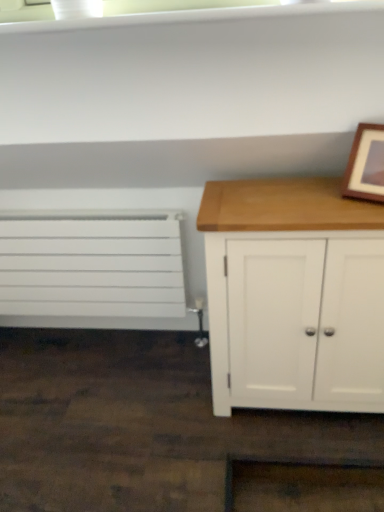
Question: Can you confirm if white wood cabinet at right is thinner than white matte radiator at left?

Choices:
 (A) no
 (B) yes

Answer: (A)

Question: Is white wood cabinet at right bigger than white matte radiator at left?

Choices:
 (A) no
 (B) yes

Answer: (B)

Question: Is white wood cabinet at right not near white matte radiator at left?

Choices:
 (A) no
 (B) yes

Answer: (A)

Question: From the image's perspective, does white wood cabinet at right appear lower than white matte radiator at left?

Choices:
 (A) no
 (B) yes

Answer: (B)

Question: Is white wood cabinet at right outside of white matte radiator at left?

Choices:
 (A) yes
 (B) no

Answer: (A)

Question: From the image's perspective, relative to white wood cabinet at right, is wooden picture frame at upper right above or below?

Choices:
 (A) above
 (B) below

Answer: (A)

Question: Considering their positions, is wooden picture frame at upper right located in front of or behind white wood cabinet at right?

Choices:
 (A) behind
 (B) front

Answer: (B)

Question: From a real-world perspective, relative to white wood cabinet at right, is wooden picture frame at upper right vertically above or below?

Choices:
 (A) above
 (B) below

Answer: (A)

Question: Looking at their shapes, would you say wooden picture frame at upper right is wider or thinner than white wood cabinet at right?

Choices:
 (A) wide
 (B) thin

Answer: (B)

Question: Is white wood cabinet at right taller or shorter than white matte radiator at left?

Choices:
 (A) short
 (B) tall

Answer: (B)

Question: Does point (244, 253) appear closer or farther from the camera than point (139, 244)?

Choices:
 (A) farther
 (B) closer

Answer: (B)

Question: Relative to white matte radiator at left, is white wood cabinet at right in front or behind?

Choices:
 (A) behind
 (B) front

Answer: (B)

Question: From the image's perspective, relative to white matte radiator at left, is white wood cabinet at right above or below?

Choices:
 (A) above
 (B) below

Answer: (B)

Question: Relative to wooden picture frame at upper right, is white wood cabinet at right in front or behind?

Choices:
 (A) behind
 (B) front

Answer: (A)

Question: Choose the correct answer: Is white wood cabinet at right inside wooden picture frame at upper right or outside it?

Choices:
 (A) outside
 (B) inside

Answer: (A)